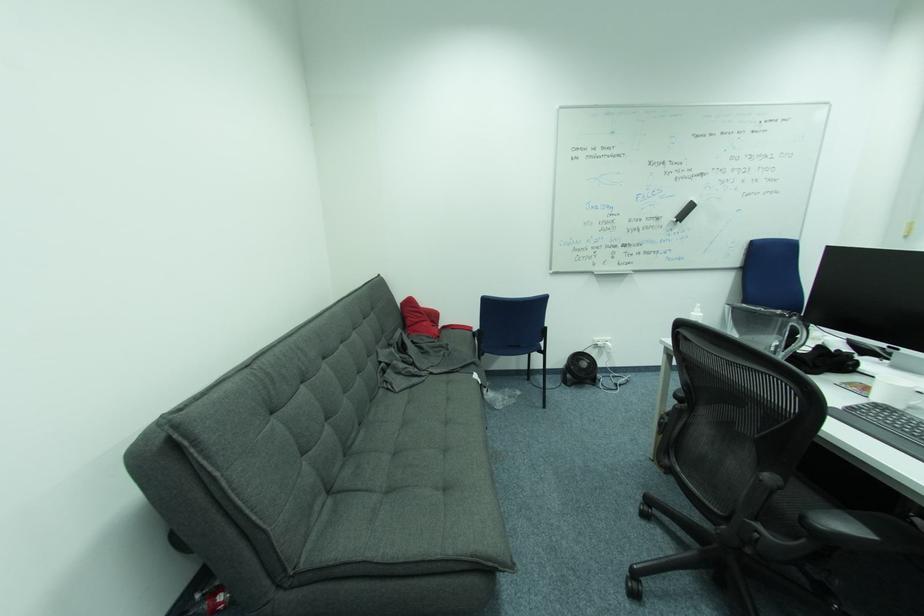
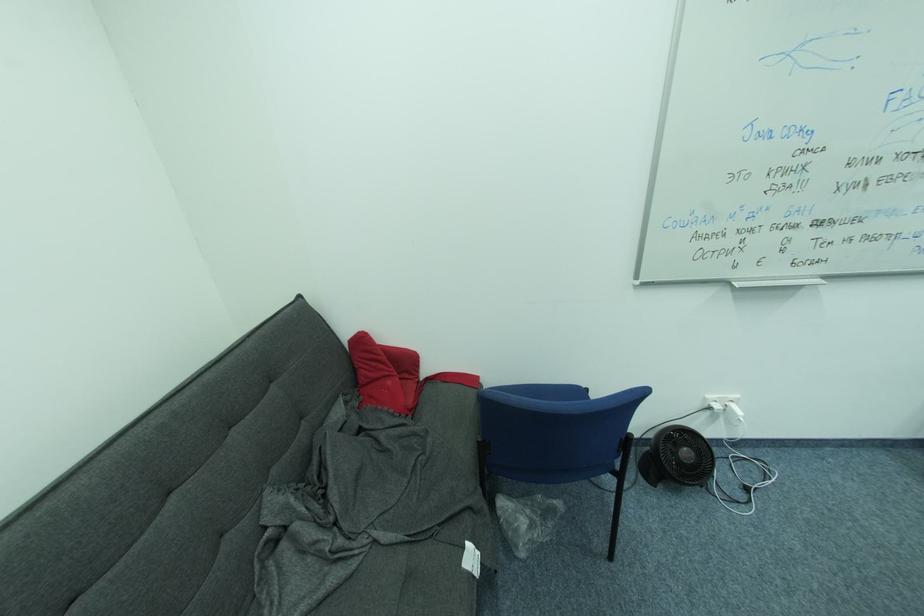
The point at (432, 378) is marked in the first image. Where is the corresponding point in the second image?

(368, 559)